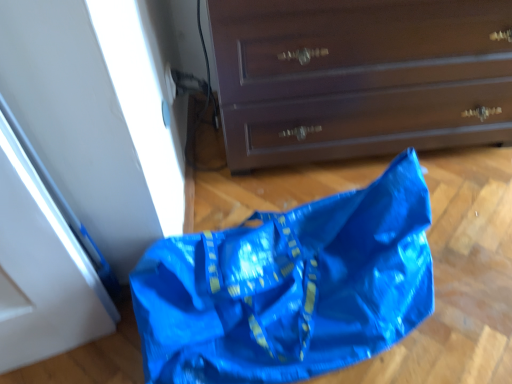
Question: From the image's perspective, relative to blue plastic bag at lower left, is matte brown chest of drawers at center above or below?

Choices:
 (A) above
 (B) below

Answer: (A)

Question: From their relative heights in the image, would you say matte brown chest of drawers at center is taller or shorter than blue plastic bag at lower left?

Choices:
 (A) tall
 (B) short

Answer: (A)

Question: From a real-world perspective, is matte brown chest of drawers at center positioned above or below blue plastic bag at lower left?

Choices:
 (A) below
 (B) above

Answer: (B)

Question: Considering the positions of blue plastic bag at lower left and matte brown chest of drawers at center in the image, is blue plastic bag at lower left wider or thinner than matte brown chest of drawers at center?

Choices:
 (A) thin
 (B) wide

Answer: (A)

Question: From a real-world perspective, relative to matte brown chest of drawers at center, is blue plastic bag at lower left vertically above or below?

Choices:
 (A) above
 (B) below

Answer: (B)

Question: Relative to matte brown chest of drawers at center, is blue plastic bag at lower left in front or behind?

Choices:
 (A) front
 (B) behind

Answer: (A)

Question: Is blue plastic bag at lower left situated inside matte brown chest of drawers at center or outside?

Choices:
 (A) inside
 (B) outside

Answer: (B)